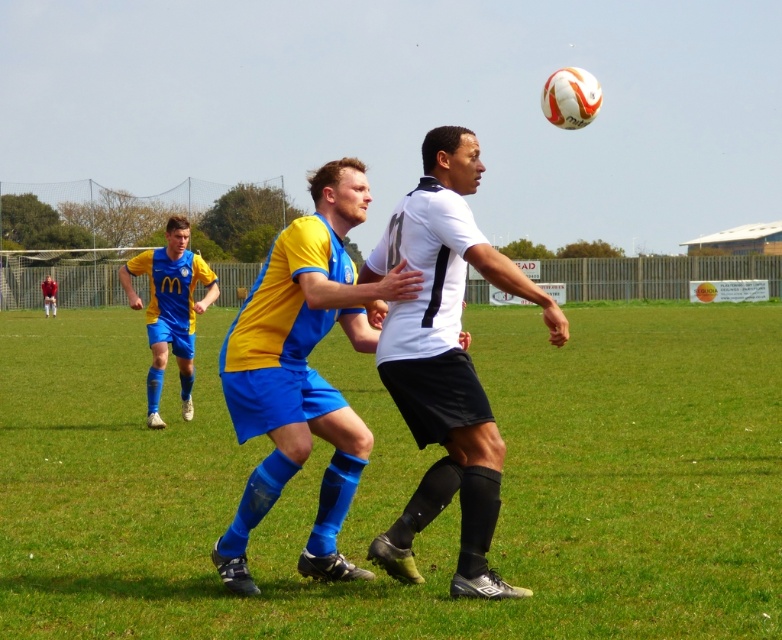
Question: Can you confirm if green grass at center is wider than white matte soccer ball at upper center?

Choices:
 (A) no
 (B) yes

Answer: (B)

Question: Which object is closer to the camera taking this photo?

Choices:
 (A) green grass at center
 (B) yellow jersey at center
 (C) yellow/blue jersey at center
 (D) white matte soccer ball at upper center

Answer: (A)

Question: Which of the following is the farthest from the observer?

Choices:
 (A) (490, 474)
 (B) (289, 241)

Answer: (B)

Question: Is yellow/blue jersey at center positioned behind red fabric shirt at center?

Choices:
 (A) yes
 (B) no

Answer: (B)

Question: Is white matte soccer ball at upper center thinner than yellow jersey at center?

Choices:
 (A) yes
 (B) no

Answer: (A)

Question: Which of the following is the farthest from the observer?

Choices:
 (A) yellow/blue jersey at center
 (B) yellow jersey at center
 (C) white matte soccer ball at upper center

Answer: (B)